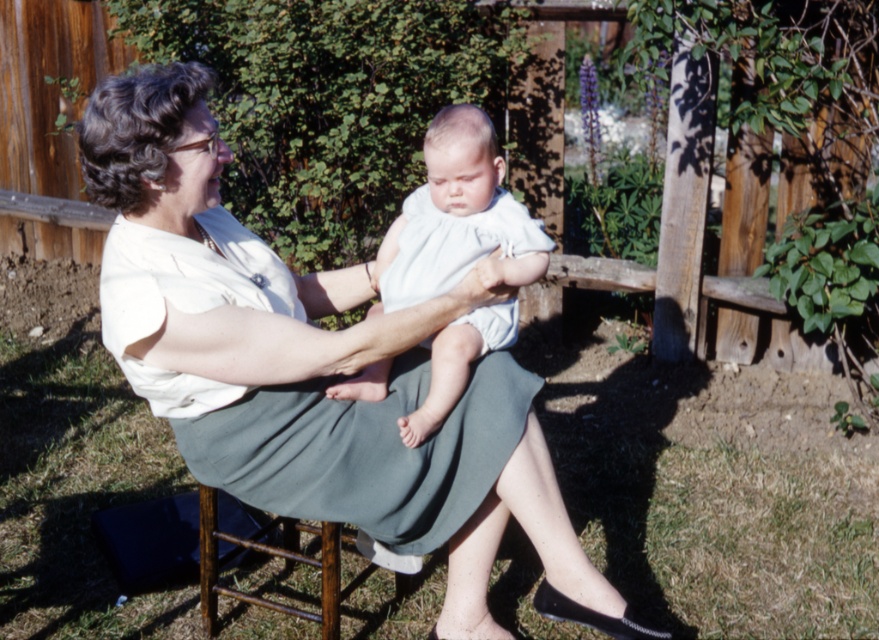
Question: Estimate the real-world distances between objects in this image. Which object is closer to the white cotton blouse at upper center?

Choices:
 (A) light blue cotton dress at center
 (B) white cotton dress at center

Answer: (A)

Question: Is white cotton blouse at upper center smaller than light blue cotton dress at center?

Choices:
 (A) no
 (B) yes

Answer: (A)

Question: Does white cotton blouse at upper center appear on the right side of white cotton dress at center?

Choices:
 (A) yes
 (B) no

Answer: (B)

Question: Which of these objects is positioned closest to the light blue cotton dress at center?

Choices:
 (A) white cotton dress at center
 (B) white cotton blouse at upper center

Answer: (B)

Question: Which object is farther from the camera taking this photo?

Choices:
 (A) white cotton dress at center
 (B) white cotton blouse at upper center

Answer: (A)

Question: Considering the relative positions of white cotton blouse at upper center and white cotton dress at center in the image provided, where is white cotton blouse at upper center located with respect to white cotton dress at center?

Choices:
 (A) left
 (B) right

Answer: (A)